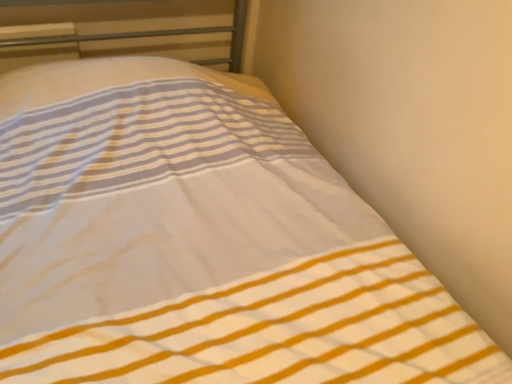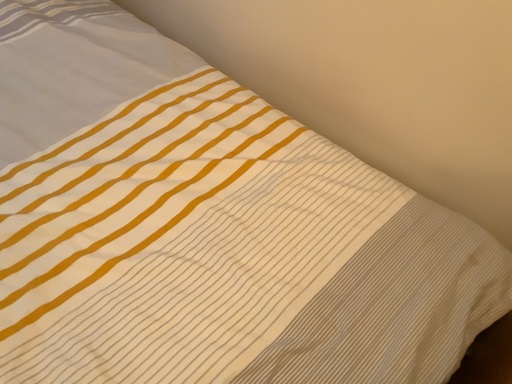
Question: How did the camera likely rotate when shooting the video?

Choices:
 (A) rotated upward
 (B) rotated downward

Answer: (B)